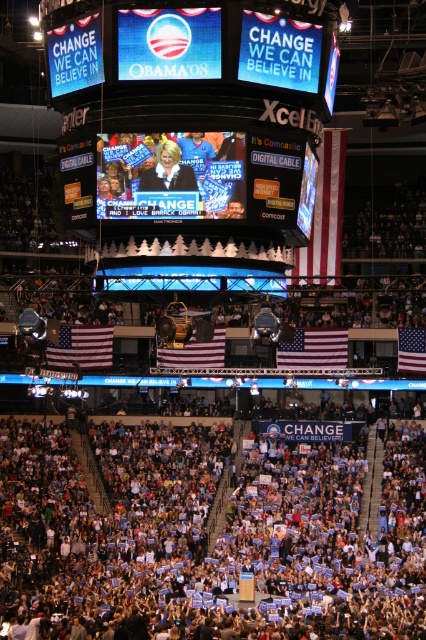
You are a photographer at the rally and want to capture both the white cotton flag at center and the red fabric flag at right in a single shot. Given that your camera has a fixed focal length, which flag should you position closer to the center of your frame to ensure both fit in the photo?

Since the white cotton flag at center is wider than the red fabric flag at right, you should position the white cotton flag at center closer to the center of your frame to ensure both fit in the photo.

From the picture: You are a photographer at the rally and need to capture a wide shot of both the american flag at center and the red fabric flag at right. Given their sizes, which flag should you position closer to the camera to ensure both appear similarly sized in the photo?

The american flag at center is wider than the red fabric flag at right. To make them appear similarly sized in the photo, position the wider american flag at center closer to the camera while keeping the narrower red fabric flag at right farther away.